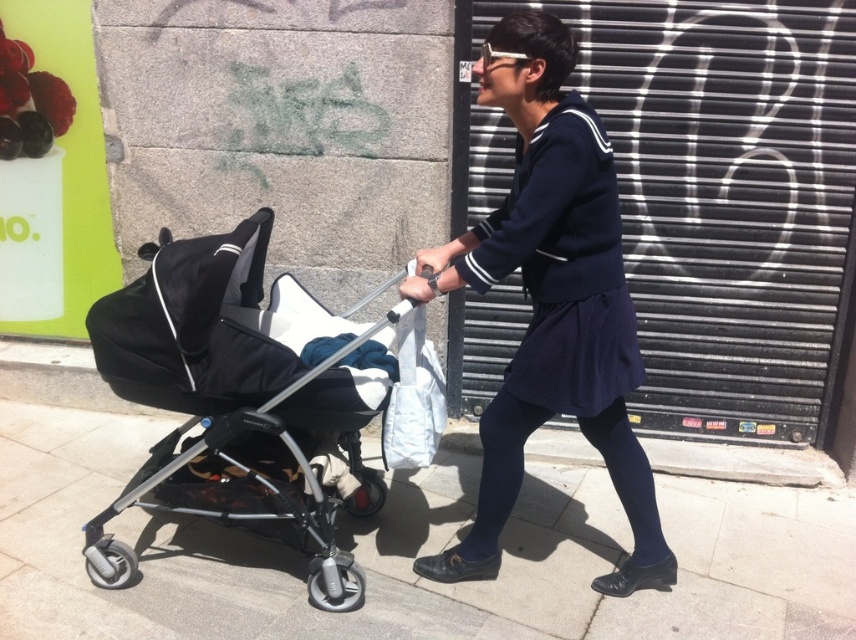
Does navy blue dress at center appear over black matte stroller at left?

Yes, navy blue dress at center is above black matte stroller at left.

How much distance is there between navy blue dress at center and black matte stroller at left?

navy blue dress at center is 23.58 inches from black matte stroller at left.

What do you see at coordinates (550, 301) in the screenshot? The height and width of the screenshot is (640, 856). I see `navy blue dress at center` at bounding box center [550, 301].

The height and width of the screenshot is (640, 856). I want to click on navy blue dress at center, so click(x=550, y=301).

Is the position of gray concrete pavement at center more distant than that of black matte stroller at left?

Yes, gray concrete pavement at center is further from the viewer.

Can you confirm if gray concrete pavement at center is positioned above black matte stroller at left?

No, gray concrete pavement at center is not above black matte stroller at left.

Who is more forward, (176, 628) or (276, 490)?

Point (176, 628)

Find the location of a particular element. gray concrete pavement at center is located at coordinates (412, 554).

Which of these two, gray concrete pavement at center or navy blue dress at center, stands taller?

With more height is navy blue dress at center.

In the scene shown: Between gray concrete pavement at center and navy blue dress at center, which one is positioned higher?

Positioned higher is navy blue dress at center.

Where is `gray concrete pavement at center`? The height and width of the screenshot is (640, 856). gray concrete pavement at center is located at coordinates (412, 554).